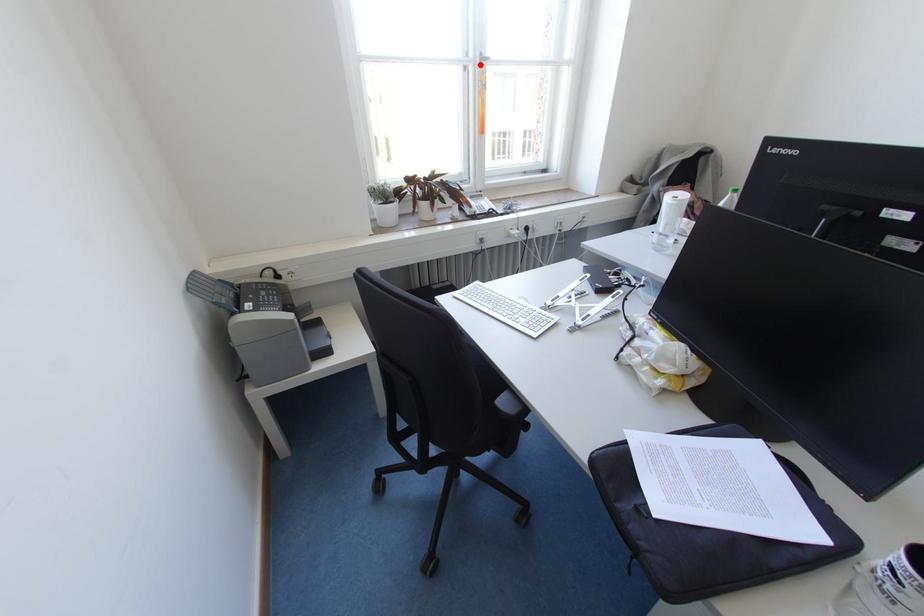
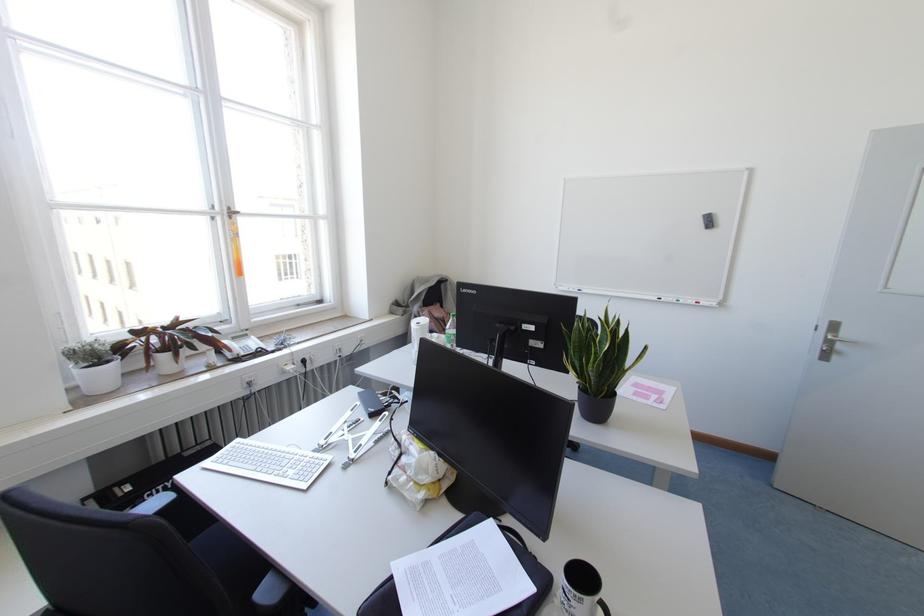
Where in the second image is the point corresponding to the highlighted location from the first image?

(229, 217)